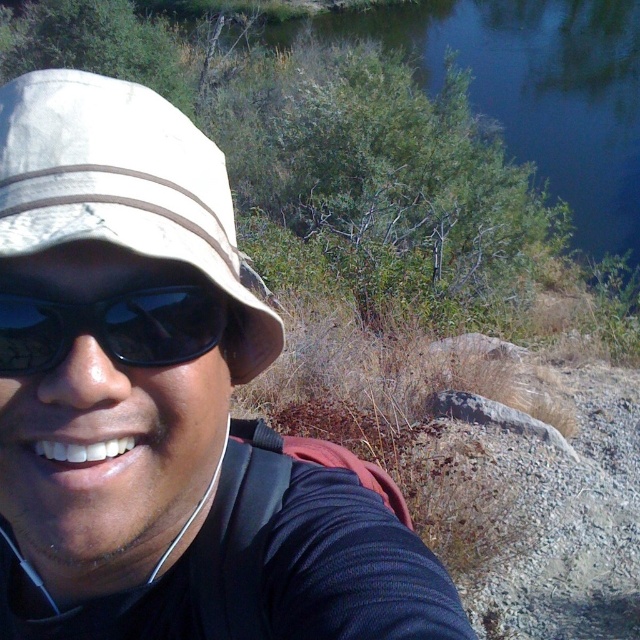
You are a photographer trying to capture the scene. You notice the white matte hat at upper left and the blue water at upper center. Which object is positioned higher in the image?

The blue water at upper center is positioned higher in the image than the white matte hat at upper left.

You are a photographer trying to capture the person in the scene. You notice the white matte hat at upper left and the black matte sunglasses at left. Which object should you focus on first if you want to capture the larger object in your frame?

The white matte hat at upper left is bigger than the black matte sunglasses at left, so you should focus on the white matte hat at upper left first to capture the larger object in your frame.

You are a photographer trying to capture the white matte hat at upper left and the blue water at upper center in a single shot. Based on their positions, which object would appear closer to the camera in the photo?

The white matte hat at upper left appears closer to the camera because it is positioned in front of the blue water at upper center.